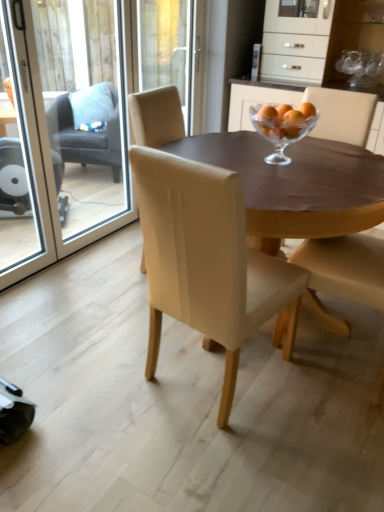
Question: Should I look upward or downward to see matte beige chair at center, the 3th chair when ordered from back to front?

Choices:
 (A) down
 (B) up

Answer: (B)

Question: Considering the relative sizes of leather at center, placed as the 2th chair when sorted from left to right, and transparent glass screen door at left, which is counted as the second screen door, starting from the left, in the image provided, is leather at center, placed as the 2th chair when sorted from left to right, shorter than transparent glass screen door at left, which is counted as the second screen door, starting from the left,?

Choices:
 (A) yes
 (B) no

Answer: (A)

Question: Considering the relative sizes of leather at center, which is the 2th chair from back to front, and transparent glass screen door at left, which appears as the first screen door when viewed from the right, in the image provided, is leather at center, which is the 2th chair from back to front, bigger than transparent glass screen door at left, which appears as the first screen door when viewed from the right,?

Choices:
 (A) no
 (B) yes

Answer: (B)

Question: Does leather at center, acting as the 3th chair starting from the front, have a lesser width compared to transparent glass screen door at left, which appears as the first screen door when viewed from the right?

Choices:
 (A) no
 (B) yes

Answer: (A)

Question: From a real-world perspective, is leather at center, which is the 2th chair from back to front, on top of transparent glass screen door at left, which is counted as the second screen door, starting from the left?

Choices:
 (A) yes
 (B) no

Answer: (B)

Question: Is leather at center, placed as the 2th chair when sorted from left to right, aimed at transparent glass screen door at left, which appears as the first screen door when viewed from the right?

Choices:
 (A) yes
 (B) no

Answer: (B)

Question: Considering the relative sizes of leather at center, placed as the 2th chair when sorted from left to right, and transparent glass screen door at left, which is counted as the second screen door, starting from the left, in the image provided, is leather at center, placed as the 2th chair when sorted from left to right, smaller than transparent glass screen door at left, which is counted as the second screen door, starting from the left,?

Choices:
 (A) yes
 (B) no

Answer: (B)

Question: Is clear glass bowl at center to the right of transparent glass screen door at left, positioned as the 1th screen door in left-to-right order, from the viewer's perspective?

Choices:
 (A) yes
 (B) no

Answer: (A)

Question: From a real-world perspective, is clear glass bowl at center located higher than transparent glass screen door at left, positioned as the 1th screen door in left-to-right order?

Choices:
 (A) yes
 (B) no

Answer: (A)

Question: Can you confirm if clear glass bowl at center is taller than transparent glass screen door at left, the second screen door positioned from the right?

Choices:
 (A) no
 (B) yes

Answer: (A)

Question: Is clear glass bowl at center thinner than transparent glass screen door at left, positioned as the 1th screen door in left-to-right order?

Choices:
 (A) no
 (B) yes

Answer: (A)

Question: Is clear glass bowl at center touching transparent glass screen door at left, the second screen door positioned from the right?

Choices:
 (A) yes
 (B) no

Answer: (B)

Question: Is clear glass bowl at center positioned before transparent glass screen door at left, positioned as the 1th screen door in left-to-right order?

Choices:
 (A) no
 (B) yes

Answer: (A)

Question: Is beige leather chair at center, the 1th chair viewed from the front, completely or partially outside of matte beige chair at center, positioned as the 4th chair in left-to-right order?

Choices:
 (A) yes
 (B) no

Answer: (A)